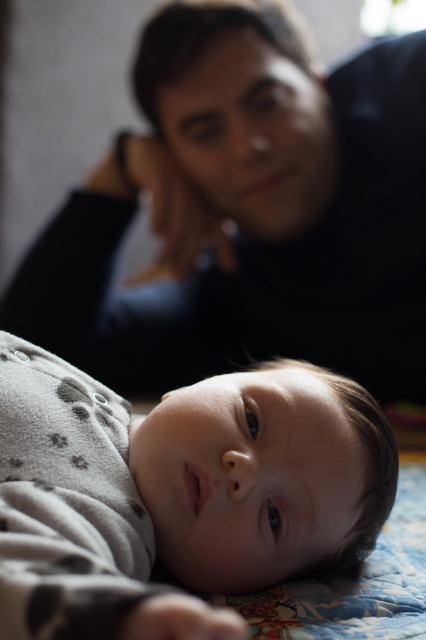
Consider the image. You are standing in the room where the baby and the adult are. You need to locate the black matte shirt at upper center. Where exactly should you look?

The black matte shirt at upper center is located at point (247, 212).

You are a photographer who wants to capture a closeup of the black matte shirt at upper center and the gray dotted fabric at lower center in the image. Which object is positioned higher in the frame?

The black matte shirt at upper center is located above the gray dotted fabric at lower center, so it is positioned higher in the frame.

You are a photographer setting up for a family photo. You need to ensure that the black matte shirt at upper center and the gray dotted fabric at lower center are in focus. Given that your camera can only focus on objects within a 20 inch range, will both items be in focus?

The distance between the black matte shirt at upper center and the gray dotted fabric at lower center is 23.83 inches. Since the camera can only focus within a 20 inch range, the two items are too far apart to both be in focus simultaneously.